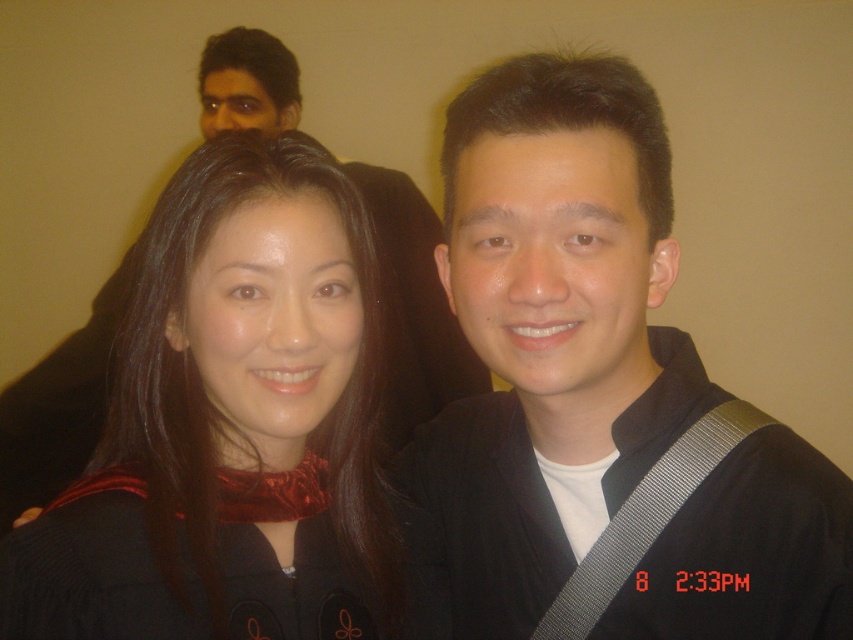
You are a photographer standing in front of the velvet black dress at center. You want to take a clear photo of it. What is the minimum distance you should maintain to ensure the dress is in focus?

The velvet black dress at center and viewer are 22.83 inches apart. To ensure the dress is in focus, the photographer should maintain a distance of at least 22.83 inches from the dress.

You are a photographer standing in front of the velvet black dress at center. You want to take a closeup shot of it without moving the dress. Can you step forward to get a better shot?

The velvet black dress at center is 58.00 centimeters away from viewer. Since you can move closer, stepping forward would allow you to get a better closeup shot without needing to move the dress.